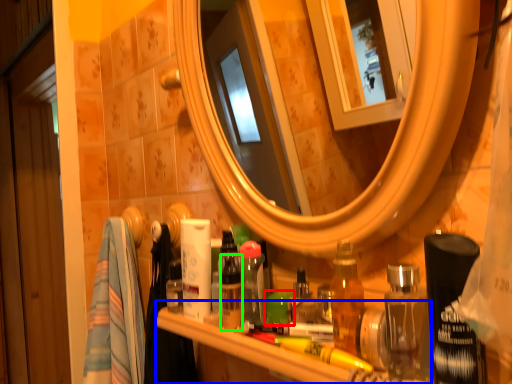
Question: Estimate the real-world distances between objects in this image. Which object is farther from toiletry (highlighted by a red box), counter (highlighted by a blue box) or toiletry (highlighted by a green box)?

Choices:
 (A) counter
 (B) toiletry

Answer: (A)